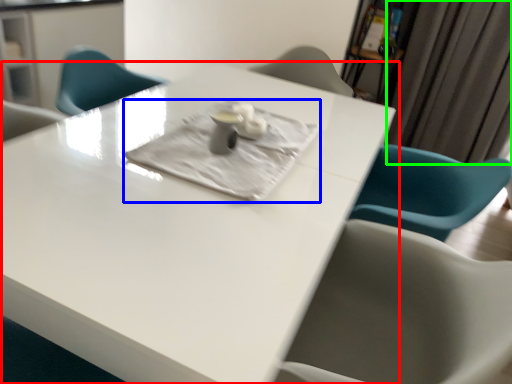
Question: Estimate the real-world distances between objects in this image. Which object is closer to table (highlighted by a red box), cloth (highlighted by a blue box) or curtain (highlighted by a green box)?

Choices:
 (A) cloth
 (B) curtain

Answer: (A)